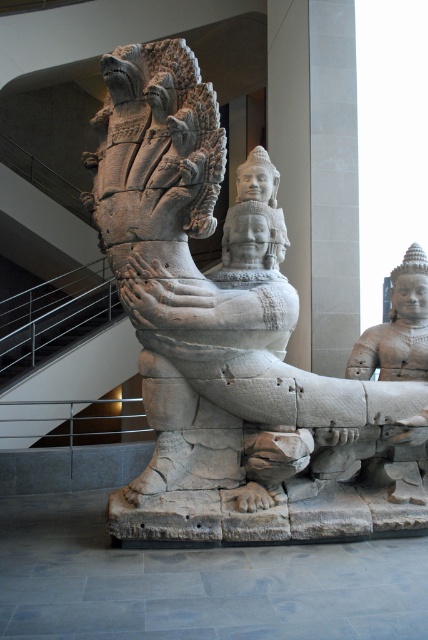
You are standing in a museum and want to take a photo of the white stone statue at center. If you are positioned at point 0.5, 0.5, which direction should you move to get a better view of the statue?

Since the white stone statue at center is located at point (213, 301), it is slightly to the left and below your current position at (214, 320). To get a better view, you should move slightly to the right and upwards to align yourself directly in front of the statue.